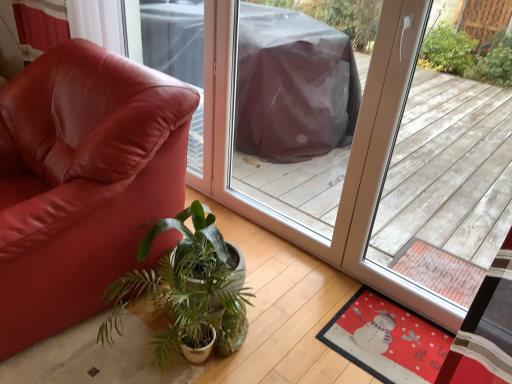
Question: Is green leafy plant at center in front of or behind red felt mat at lower right in the image?

Choices:
 (A) front
 (B) behind

Answer: (A)

Question: Looking at the image, does green leafy plant at center seem bigger or smaller compared to red felt mat at lower right?

Choices:
 (A) big
 (B) small

Answer: (A)

Question: Which of these objects is positioned farthest from the red felt mat at lower right?

Choices:
 (A) matte leather chair at left
 (B) green leafy plant at center

Answer: (A)

Question: Which is nearer to the matte leather chair at left?

Choices:
 (A) red felt mat at lower right
 (B) green leafy plant at center

Answer: (B)